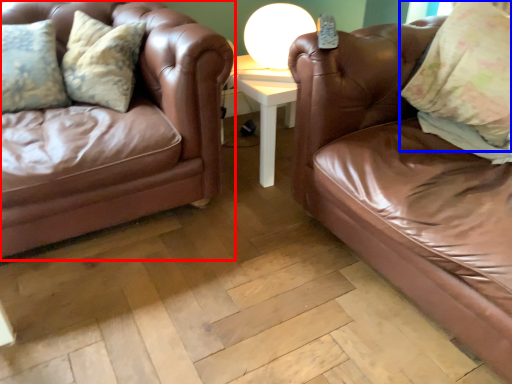
Question: Which point is closer to the camera, studio couch (highlighted by a red box) or pillow (highlighted by a blue box)?

Choices:
 (A) studio couch
 (B) pillow

Answer: (A)